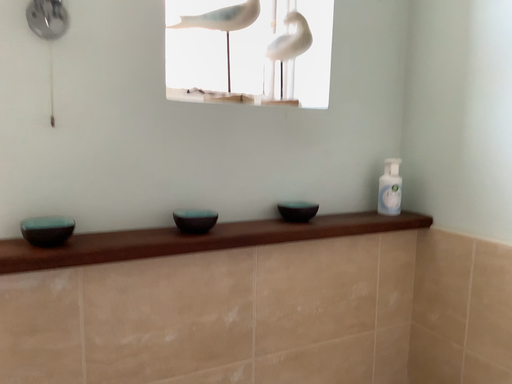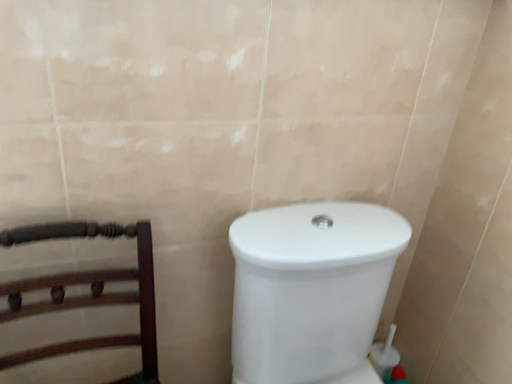
Question: How did the camera likely rotate when shooting the video?

Choices:
 (A) rotated upward
 (B) rotated downward

Answer: (B)